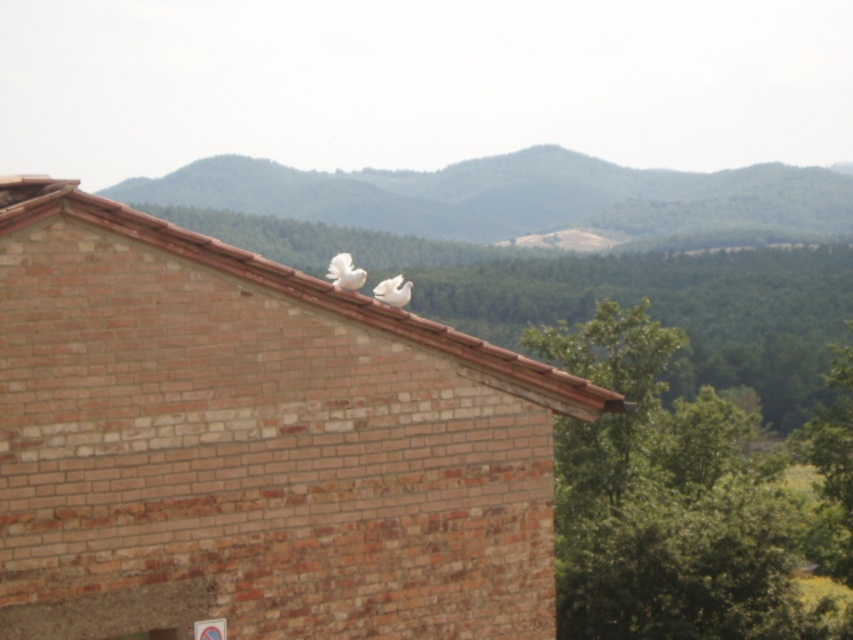
You are a birdwatcher observing the scene from a distance. You notice the brown tile roof at upper center and the white feathered bird at center. Which object is located higher in the image?

The white feathered bird at center is higher because the brown tile roof at upper center is positioned under it.

You are an architect assessing the building. From your perspective, which object is wider when comparing the brown tile roof at upper center and the white feathered bird at center?

The brown tile roof at upper center is wider than the white feathered bird at center.